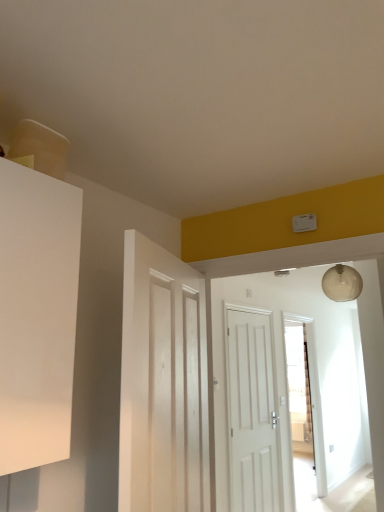
Question: From a real-world perspective, is white wooden door at center, which is counted as the second door, starting from the right, above or below transparent glass door at center?

Choices:
 (A) below
 (B) above

Answer: (B)

Question: Is point (140, 487) closer or farther from the camera than point (306, 338)?

Choices:
 (A) farther
 (B) closer

Answer: (B)

Question: Which of these objects is positioned farthest from the white wooden door at center, the second door in the back-to-front sequence?

Choices:
 (A) transparent glass door at center
 (B) white matte door at center, the 2th door positioned from the front

Answer: (A)

Question: Which is nearer to the white wooden door at center, which ranks as the 1th door in front-to-back order?

Choices:
 (A) transparent glass door at center
 (B) white matte door at center, which ranks as the 1th door in back-to-front order

Answer: (B)